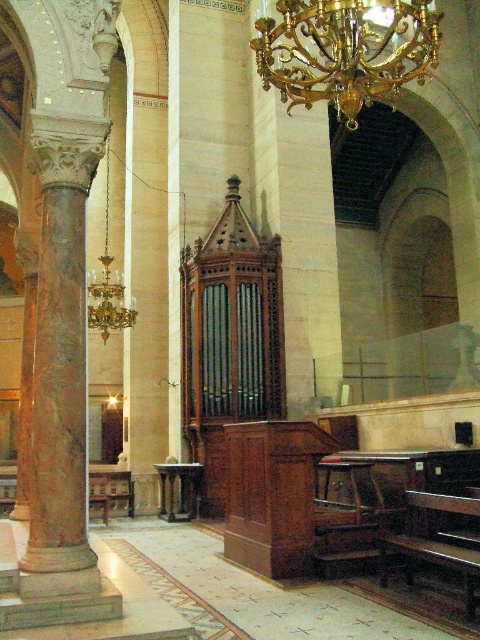
You are standing at the entrance of the church and see the point marked at coordinates (60, 362). What object is located at that point?

The point at coordinates (60, 362) corresponds to the marble column at left.